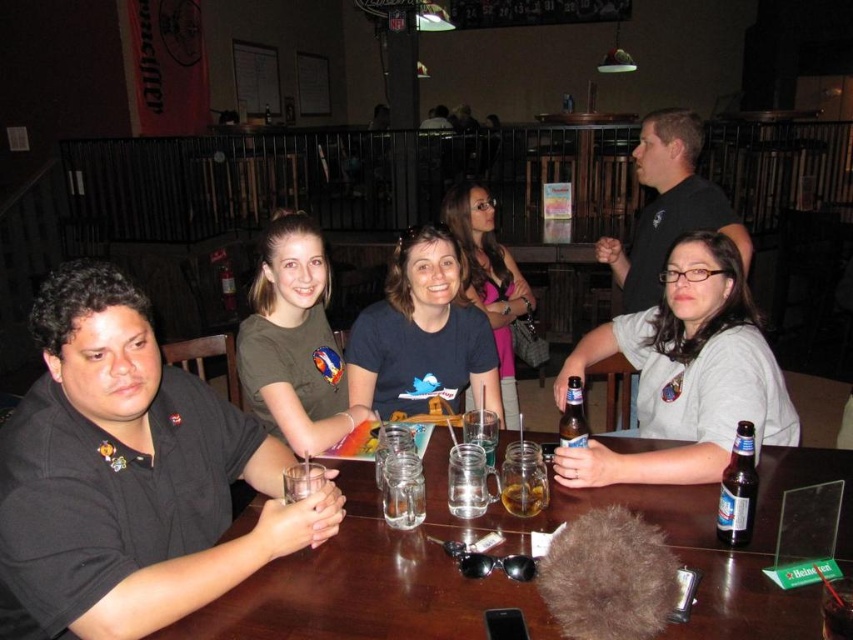
Question: Which point is farther to the camera?

Choices:
 (A) click(x=509, y=369)
 (B) click(x=167, y=637)
 (C) click(x=656, y=257)

Answer: (A)

Question: Is gray matte shirt at center below matte black shirt at center?

Choices:
 (A) no
 (B) yes

Answer: (A)

Question: Does transparent glass table at center lie in front of translucent glass mug at table center?

Choices:
 (A) no
 (B) yes

Answer: (B)

Question: Which object is the closest to the matte black shirt at center?

Choices:
 (A) matte blue shirt at center
 (B) green matte shirt at center

Answer: (A)

Question: Can you confirm if gray cotton shirt at center is smaller than matte blue shirt at center?

Choices:
 (A) no
 (B) yes

Answer: (A)

Question: Estimate the real-world distances between objects in this image. Which object is farther from the dark brown glass bottle at table right?

Choices:
 (A) transparent glass table at center
 (B) matte blue shirt at center
 (C) gray cotton shirt at center

Answer: (B)